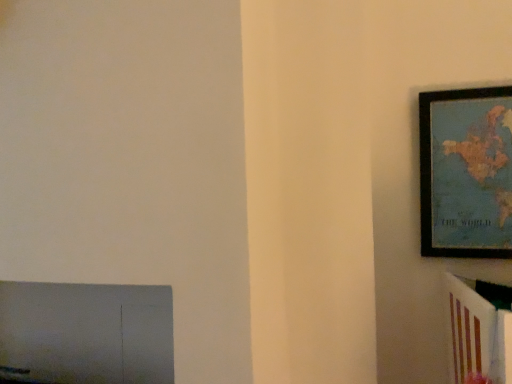
Question: Considering their positions, is wooden framed map at upper right located in front of or behind white glossy bookshelf at right?

Choices:
 (A) front
 (B) behind

Answer: (B)

Question: Based on their positions, is wooden framed map at upper right located to the left or right of white glossy bookshelf at right?

Choices:
 (A) left
 (B) right

Answer: (B)

Question: From the image's perspective, is wooden framed map at upper right positioned above or below white glossy bookshelf at right?

Choices:
 (A) below
 (B) above

Answer: (B)

Question: From a real-world perspective, is white glossy bookshelf at right above or below wooden framed map at upper right?

Choices:
 (A) below
 (B) above

Answer: (A)

Question: Is point (457, 291) positioned closer to the camera than point (458, 213)?

Choices:
 (A) farther
 (B) closer

Answer: (B)

Question: Is white glossy bookshelf at right taller or shorter than wooden framed map at upper right?

Choices:
 (A) tall
 (B) short

Answer: (B)

Question: In the image, is white glossy bookshelf at right positioned in front of or behind wooden framed map at upper right?

Choices:
 (A) behind
 (B) front

Answer: (B)